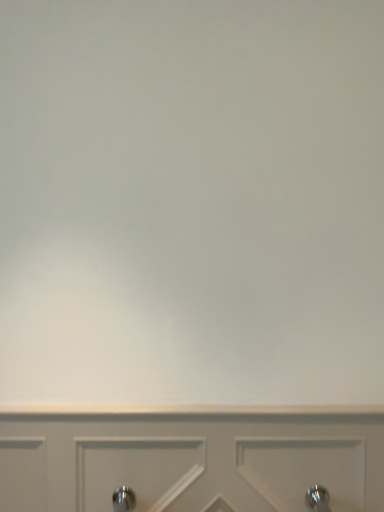
Describe the element at coordinates (191, 461) in the screenshot. This screenshot has height=512, width=384. I see `white matte barn door at bottom` at that location.

Find the location of a particular element. The image size is (384, 512). white matte barn door at bottom is located at coordinates (191, 461).

Find the location of a particular element. This screenshot has height=512, width=384. white matte barn door at bottom is located at coordinates (191, 461).